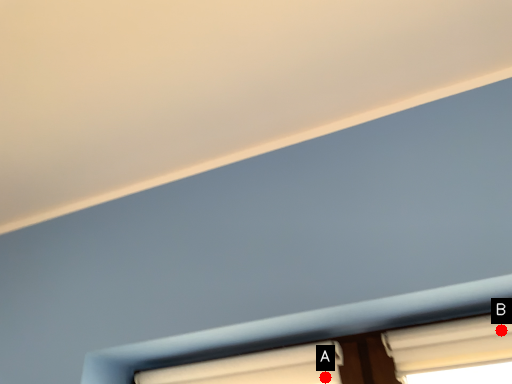
Question: Two points are circled on the image, labeled by A and B beside each circle. Which point is further to the camera?

Choices:
 (A) A is further
 (B) B is further

Answer: (A)